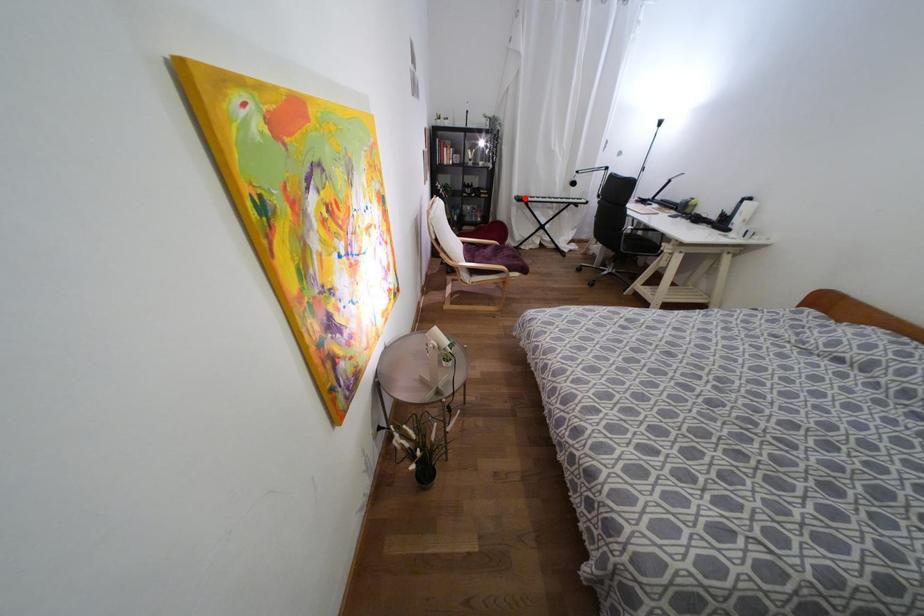
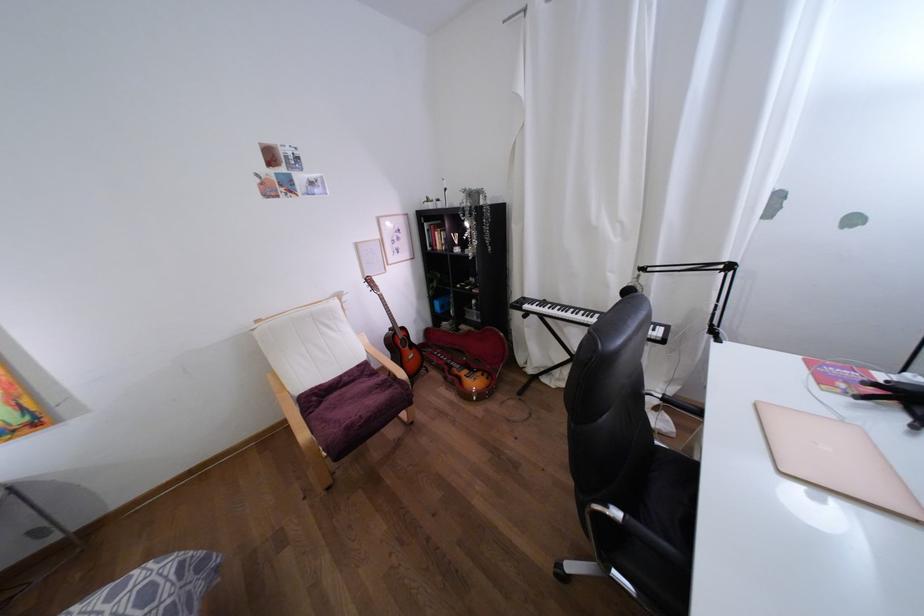
Find the pixel in the second image that matches the highlighted location in the first image.

(525, 306)